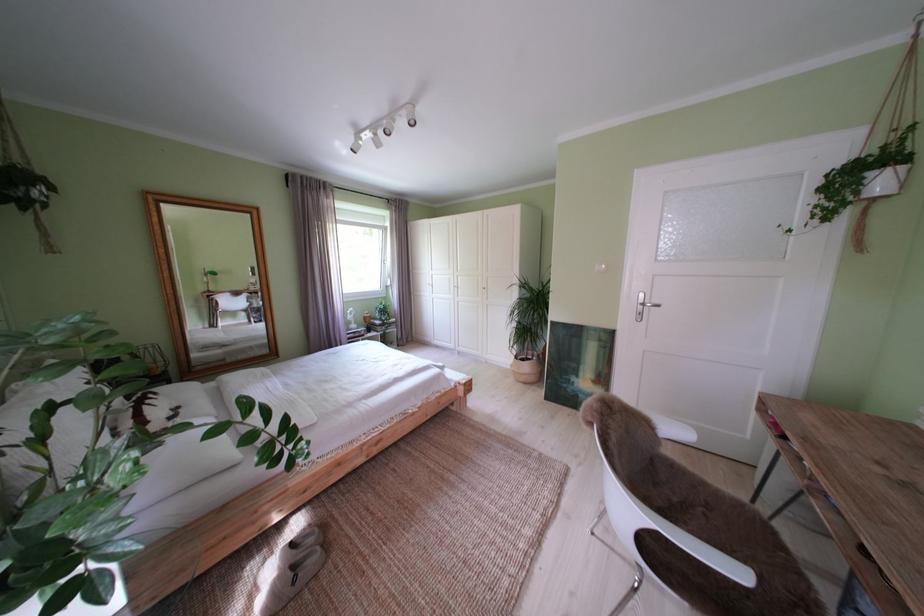
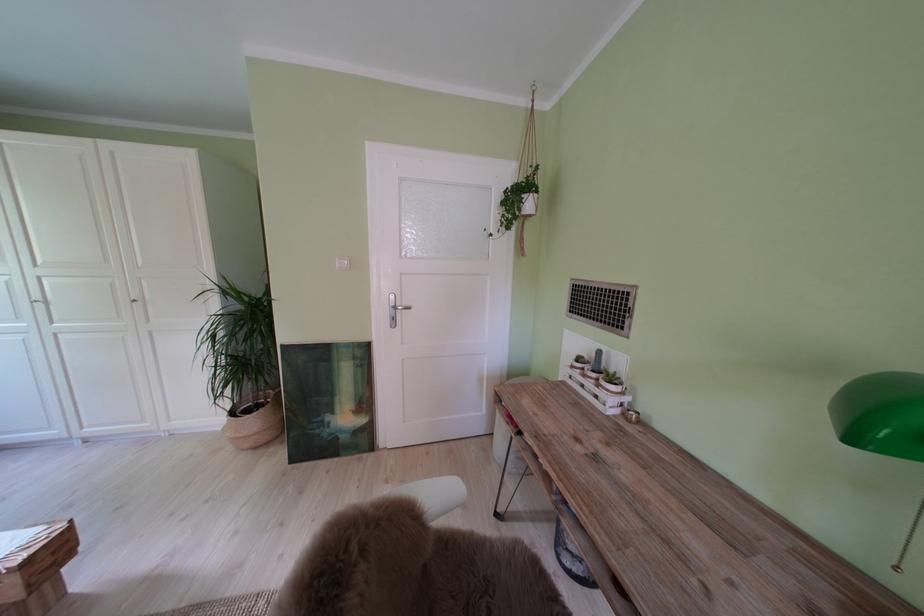
Locate, in the second image, the point that corresponds to pixel 527 363 in the first image.

(242, 418)